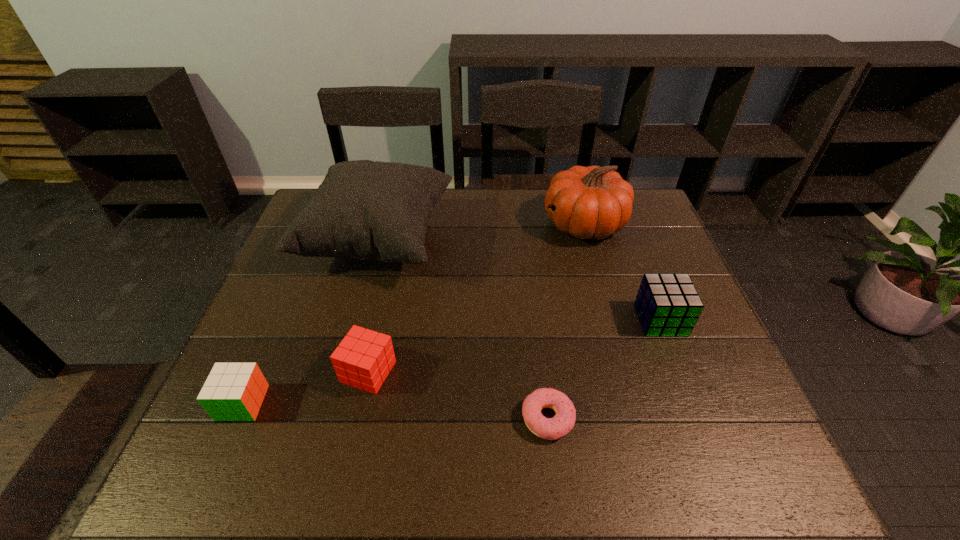
I want to click on vacant area located on the face of the pumpkin, so click(x=415, y=225).

Where is `vacant region located on the face of the pumpkin`? vacant region located on the face of the pumpkin is located at coordinates (511, 225).

What are the coordinates of `vacant position located on the front of the third farthest object` in the screenshot? It's located at (696, 413).

At what (x,y) coordinates should I click in order to perform the action: click on vacant space located on the back of the second cube from left to right. Please return your answer as a coordinate pair (x, y). The image size is (960, 540). Looking at the image, I should click on (396, 242).

The width and height of the screenshot is (960, 540). Find the location of `vacant space located 0.260m on the back of the leftmost cube`. vacant space located 0.260m on the back of the leftmost cube is located at coordinates (287, 299).

You are a GUI agent. You are given a task and a screenshot of the screen. Output one action in this format:
    pyautogui.click(x=<x>, y=<y>)
    Task: Click on the vacant area located 0.180m on the right of the fourth object from left to right
    
    Given the screenshot: What is the action you would take?
    pyautogui.click(x=660, y=418)

Locate an element on the screen. cushion positioned at the far edge is located at coordinates (366, 210).

Image resolution: width=960 pixels, height=540 pixels. What are the coordinates of `pumpkin situated at the far edge` in the screenshot? It's located at (593, 202).

In order to click on object located at the near edge in this screenshot , I will do `click(562, 423)`.

At what (x,y) coordinates should I click in order to perform the action: click on cushion that is at the left edge. Please return your answer as a coordinate pair (x, y). The width and height of the screenshot is (960, 540). Looking at the image, I should click on (366, 210).